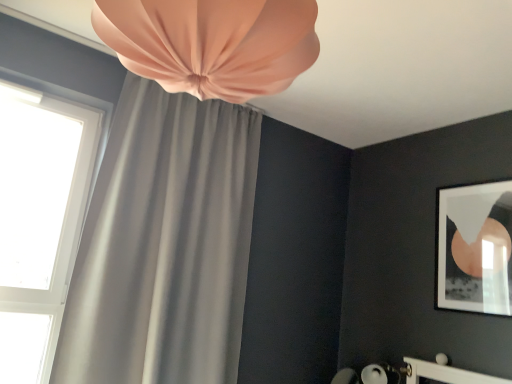
Question: From a real-world perspective, is matte gray curtain at upper left, the 1th curtain in the back-to-front sequence, positioned above or below matte black frame at upper right?

Choices:
 (A) above
 (B) below

Answer: (B)

Question: Do you think matte gray curtain at upper left, the 1th curtain in the back-to-front sequence, is within matte black frame at upper right, or outside of it?

Choices:
 (A) outside
 (B) inside

Answer: (A)

Question: Estimate the real-world distances between objects in this image. Which object is closer to the matte gray curtain at upper left, the 2th curtain when ordered from back to front?

Choices:
 (A) matte black frame at upper right
 (B) white glass window at upper left
 (C) matte gray curtain at upper left, the 1th curtain in the back-to-front sequence

Answer: (C)

Question: Which of these objects is positioned farthest from the matte gray curtain at upper left, the 2th curtain in the front-to-back sequence?

Choices:
 (A) matte gray curtain at upper left, the first curtain when ordered from front to back
 (B) matte black frame at upper right
 (C) white glass window at upper left

Answer: (B)